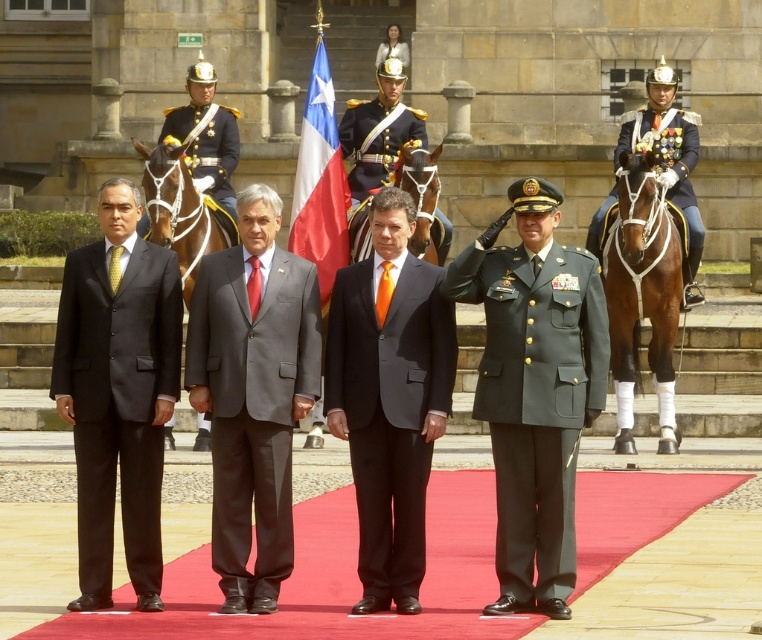
Question: Observing the image, what is the correct spatial positioning of brown glossy horse at right in reference to brown leather horse at center?

Choices:
 (A) above
 (B) below

Answer: (B)

Question: Which point is farther from the camera taking this photo?

Choices:
 (A) (171, 449)
 (B) (312, 193)
 (C) (437, 186)
 (D) (141, 506)

Answer: (B)

Question: Considering the real-world distances, which object is closest to the matte black suit at left?

Choices:
 (A) matte gray suit at center
 (B) green military uniform at center

Answer: (A)

Question: Can you confirm if matte black suit at left is smaller than brown leather horse at center?

Choices:
 (A) yes
 (B) no

Answer: (B)

Question: Is brown glossy horse at right wider than brown leather horse at center?

Choices:
 (A) yes
 (B) no

Answer: (A)

Question: Which of the following is the closest to the observer?

Choices:
 (A) shiny gold helmet at upper right
 (B) shiny gold helmet at upper center

Answer: (A)